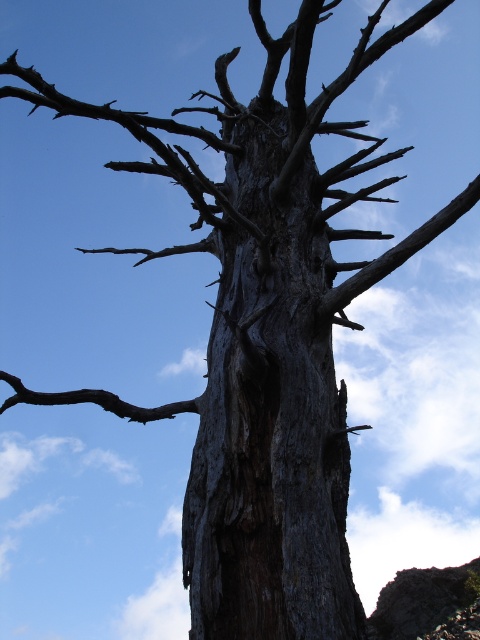
Question: Is dark gray bark tree trunk at center above brown rough branch at lower left?

Choices:
 (A) no
 (B) yes

Answer: (B)

Question: Among these points, which one is nearest to the camera?

Choices:
 (A) (187, 401)
 (B) (323, 576)

Answer: (B)

Question: Which of the following is the farthest from the observer?

Choices:
 (A) dark gray bark tree trunk at center
 (B) brown rough branch at lower left

Answer: (B)

Question: Which of the following is the closest to the observer?

Choices:
 (A) brown rough branch at lower left
 (B) dark gray bark tree trunk at center

Answer: (B)

Question: Does dark gray bark tree trunk at center have a lesser width compared to brown rough branch at lower left?

Choices:
 (A) yes
 (B) no

Answer: (B)

Question: Can you confirm if dark gray bark tree trunk at center is positioned above brown rough branch at lower left?

Choices:
 (A) no
 (B) yes

Answer: (B)